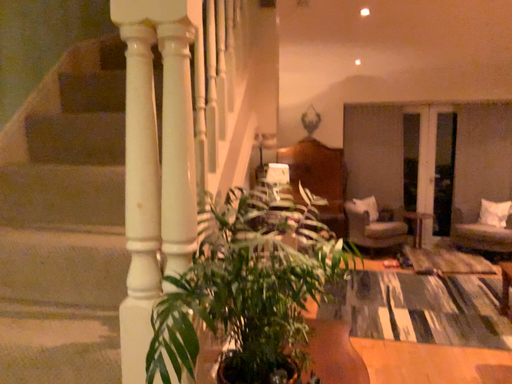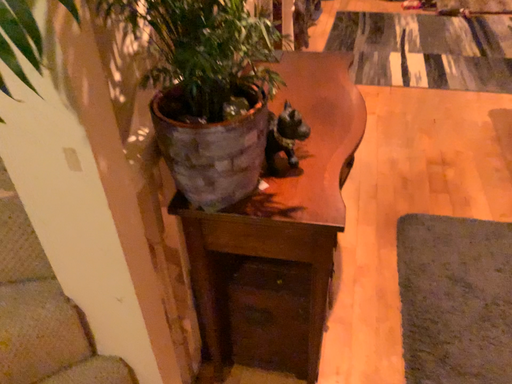
Question: How did the camera likely rotate when shooting the video?

Choices:
 (A) rotated downward
 (B) rotated upward

Answer: (A)